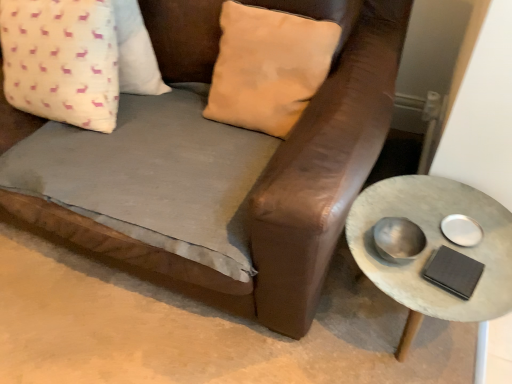
Identify the location of rustic concrete side table at right. (434, 249).

The width and height of the screenshot is (512, 384). In order to click on beige suede pillow at upper center, which is the 2th pillow from left to right in this screenshot , I will do `click(268, 67)`.

Are white fabric pillow with pink deer pattern at upper left, placed as the 1th pillow when sorted from left to right, and rustic concrete side table at right far apart?

Actually, white fabric pillow with pink deer pattern at upper left, placed as the 1th pillow when sorted from left to right, and rustic concrete side table at right are a little close together.

Which of these two, white fabric pillow with pink deer pattern at upper left, placed as the 1th pillow when sorted from left to right, or rustic concrete side table at right, is smaller?

Smaller between the two is white fabric pillow with pink deer pattern at upper left, placed as the 1th pillow when sorted from left to right.

Based on the photo, is white fabric pillow with pink deer pattern at upper left, placed as the 1th pillow when sorted from left to right, completely or partially outside of rustic concrete side table at right?

Yes, white fabric pillow with pink deer pattern at upper left, placed as the 1th pillow when sorted from left to right, is not within rustic concrete side table at right.

From the picture: Can you tell me how much white fabric pillow with pink deer pattern at upper left, placed as the 1th pillow when sorted from left to right, and rustic concrete side table at right differ in facing direction?

They differ by 3.17 degrees in their facing directions.

Is rustic concrete side table at right outside of beige suede pillow at upper center, which is the first pillow in right-to-left order?

Indeed, rustic concrete side table at right is completely outside beige suede pillow at upper center, which is the first pillow in right-to-left order.

Is rustic concrete side table at right placed right next to beige suede pillow at upper center, which is the first pillow in right-to-left order?

No, rustic concrete side table at right is not next to beige suede pillow at upper center, which is the first pillow in right-to-left order.

Is rustic concrete side table at right to the left or to the right of beige suede pillow at upper center, which is the 2th pillow from left to right, in the image?

rustic concrete side table at right is to the right of beige suede pillow at upper center, which is the 2th pillow from left to right.

Is brown leather couch at center not within rustic concrete side table at right?

Yes.

From the image's perspective, which one is positioned lower, brown leather couch at center or rustic concrete side table at right?

rustic concrete side table at right appears lower in the image.

In terms of width, does brown leather couch at center look wider or thinner when compared to rustic concrete side table at right?

brown leather couch at center is wider than rustic concrete side table at right.

You are a GUI agent. You are given a task and a screenshot of the screen. Output one action in this format:
    pyautogui.click(x=<x>, y=<y>)
    Task: Click on the table located above the brown leather couch at center (from a real-world perspective)
    The image size is (512, 384).
    Given the screenshot: What is the action you would take?
    [434, 249]

This screenshot has height=384, width=512. I want to click on pillow on the left of brown leather couch at center, so click(x=61, y=60).

Which is in front, point (366, 172) or point (17, 13)?

Point (366, 172)

Considering the positions of objects brown leather couch at center and white fabric pillow with pink deer pattern at upper left, placed as the 1th pillow when sorted from left to right, in the image provided, who is more to the left, brown leather couch at center or white fabric pillow with pink deer pattern at upper left, placed as the 1th pillow when sorted from left to right,?

white fabric pillow with pink deer pattern at upper left, placed as the 1th pillow when sorted from left to right, is more to the left.

Which of these two, beige suede pillow at upper center, which is the first pillow in right-to-left order, or white fabric pillow with pink deer pattern at upper left, placed as the 1th pillow when sorted from left to right, is thinner?

white fabric pillow with pink deer pattern at upper left, placed as the 1th pillow when sorted from left to right, is thinner.

Locate an element on the screen. Image resolution: width=512 pixels, height=384 pixels. pillow that appears in front of the white fabric pillow with pink deer pattern at upper left, placed as the 1th pillow when sorted from left to right is located at coordinates (268, 67).

From a real-world perspective, which is physically above, beige suede pillow at upper center, which is the 2th pillow from left to right, or white fabric pillow with pink deer pattern at upper left, placed as the 1th pillow when sorted from left to right?

From a 3D spatial view, beige suede pillow at upper center, which is the 2th pillow from left to right, is above.

Considering the relative positions of beige suede pillow at upper center, which is the first pillow in right-to-left order, and white fabric pillow with pink deer pattern at upper left, the 2th pillow positioned from the right, in the image provided, is beige suede pillow at upper center, which is the first pillow in right-to-left order, to the left or to the right of white fabric pillow with pink deer pattern at upper left, the 2th pillow positioned from the right,?

beige suede pillow at upper center, which is the first pillow in right-to-left order, is to the right of white fabric pillow with pink deer pattern at upper left, the 2th pillow positioned from the right.

Between brown leather couch at center and beige suede pillow at upper center, which is the 2th pillow from left to right, which one appears on the left side from the viewer's perspective?

Positioned to the left is brown leather couch at center.

Is brown leather couch at center oriented away from beige suede pillow at upper center, which is the first pillow in right-to-left order?

No.

Which is further, (269, 225) or (266, 84)?

The point (266, 84) is behind.

Measure the distance from brown leather couch at center to beige suede pillow at upper center, which is the 2th pillow from left to right.

brown leather couch at center and beige suede pillow at upper center, which is the 2th pillow from left to right, are 8.13 inches apart from each other.

Is point (476, 300) farther from camera compared to point (360, 0)?

That is False.

Is rustic concrete side table at right placed right next to brown leather couch at center?

rustic concrete side table at right is not next to brown leather couch at center, and they're not touching.

Considering the sizes of objects rustic concrete side table at right and brown leather couch at center in the image provided, who is thinner, rustic concrete side table at right or brown leather couch at center?

Thinner between the two is rustic concrete side table at right.

Identify the location of table located below the white fabric pillow with pink deer pattern at upper left, placed as the 1th pillow when sorted from left to right (from the image's perspective). (434, 249).

Find the location of a particular element. the 1st pillow counting from the left of the rustic concrete side table at right is located at coordinates (268, 67).

Considering their positions, is brown leather couch at center positioned closer to beige suede pillow at upper center, which is the first pillow in right-to-left order, than rustic concrete side table at right?

brown leather couch at center is closer to beige suede pillow at upper center, which is the first pillow in right-to-left order.

Which object lies nearer to the anchor point beige suede pillow at upper center, which is the first pillow in right-to-left order, white fabric pillow with pink deer pattern at upper left, the 2th pillow positioned from the right, or rustic concrete side table at right?

Among the two, white fabric pillow with pink deer pattern at upper left, the 2th pillow positioned from the right, is located nearer to beige suede pillow at upper center, which is the first pillow in right-to-left order.

Based on their spatial positions, is beige suede pillow at upper center, which is the first pillow in right-to-left order, or brown leather couch at center closer to white fabric pillow with pink deer pattern at upper left, the 2th pillow positioned from the right?

Among the two, brown leather couch at center is located nearer to white fabric pillow with pink deer pattern at upper left, the 2th pillow positioned from the right.

Looking at the image, which one is located closer to brown leather couch at center, beige suede pillow at upper center, which is the first pillow in right-to-left order, or rustic concrete side table at right?

Among the two, beige suede pillow at upper center, which is the first pillow in right-to-left order, is located nearer to brown leather couch at center.

When comparing their distances from rustic concrete side table at right, does brown leather couch at center or beige suede pillow at upper center, which is the 2th pillow from left to right, seem closer?

Based on the image, brown leather couch at center appears to be nearer to rustic concrete side table at right.

Based on their spatial positions, is brown leather couch at center or white fabric pillow with pink deer pattern at upper left, the 2th pillow positioned from the right, further from rustic concrete side table at right?

Based on the image, white fabric pillow with pink deer pattern at upper left, the 2th pillow positioned from the right, appears to be further to rustic concrete side table at right.

Based on their spatial positions, is rustic concrete side table at right or beige suede pillow at upper center, which is the 2th pillow from left to right, further from white fabric pillow with pink deer pattern at upper left, placed as the 1th pillow when sorted from left to right?

Among the two, rustic concrete side table at right is located further to white fabric pillow with pink deer pattern at upper left, placed as the 1th pillow when sorted from left to right.

Looking at the image, which one is located closer to beige suede pillow at upper center, which is the first pillow in right-to-left order, white fabric pillow with pink deer pattern at upper left, the 2th pillow positioned from the right, or brown leather couch at center?

brown leather couch at center lies closer to beige suede pillow at upper center, which is the first pillow in right-to-left order, than the other object.

Locate an element on the screen. studio couch situated between white fabric pillow with pink deer pattern at upper left, placed as the 1th pillow when sorted from left to right, and rustic concrete side table at right from left to right is located at coordinates [324, 170].

The width and height of the screenshot is (512, 384). What are the coordinates of `pillow between white fabric pillow with pink deer pattern at upper left, placed as the 1th pillow when sorted from left to right, and brown leather couch at center in the up-down direction` in the screenshot? It's located at (268, 67).

This screenshot has height=384, width=512. I want to click on studio couch between beige suede pillow at upper center, which is the 2th pillow from left to right, and rustic concrete side table at right vertically, so click(324, 170).

At what (x,y) coordinates should I click in order to perform the action: click on pillow situated between white fabric pillow with pink deer pattern at upper left, placed as the 1th pillow when sorted from left to right, and rustic concrete side table at right from left to right. Please return your answer as a coordinate pair (x, y). Looking at the image, I should click on (268, 67).